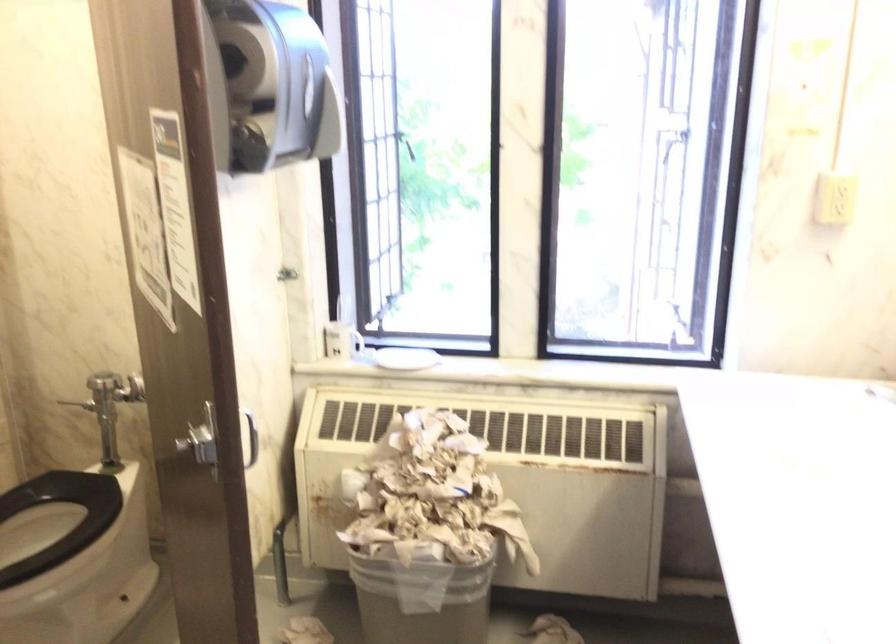
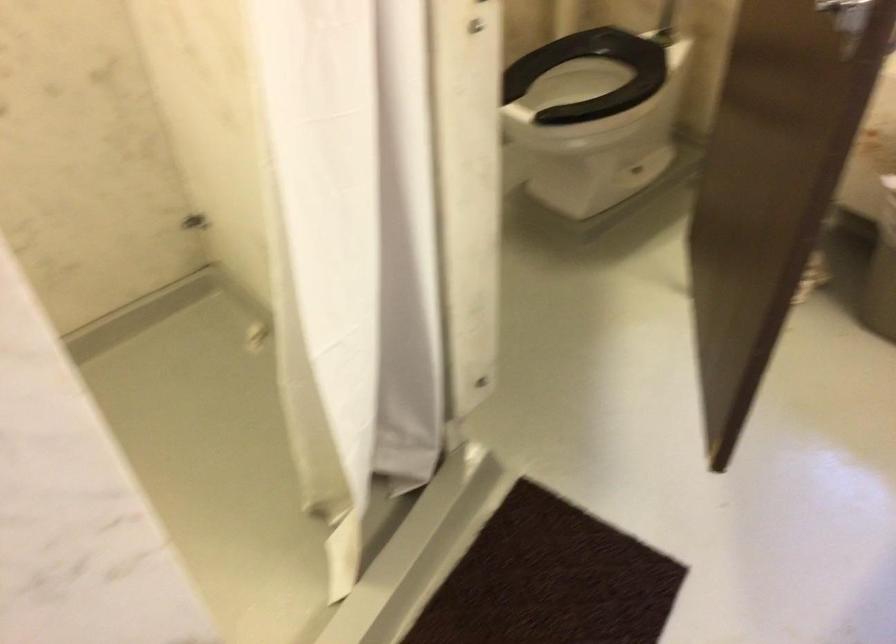
Where in the second image is the point corresponding to (234,442) from the first image?

(849, 14)